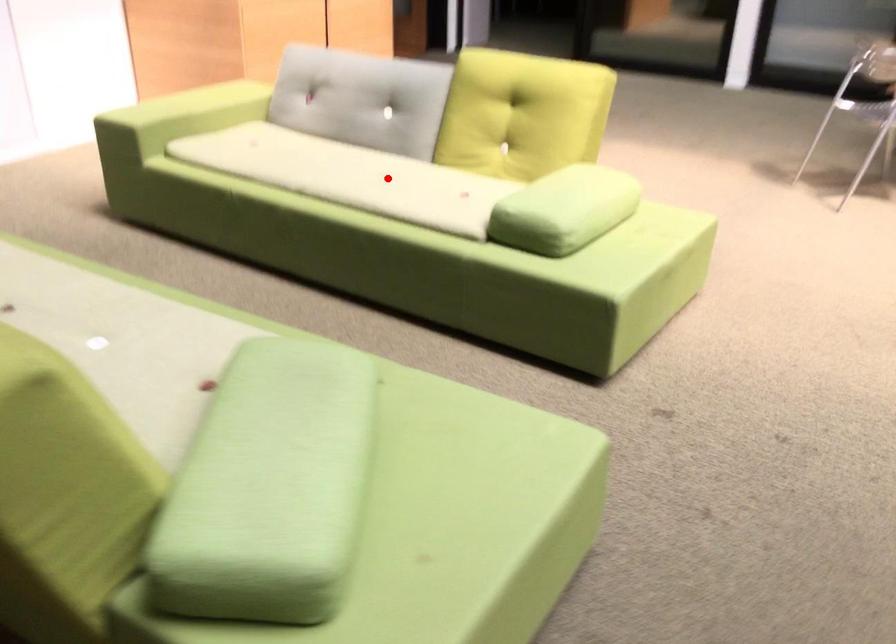
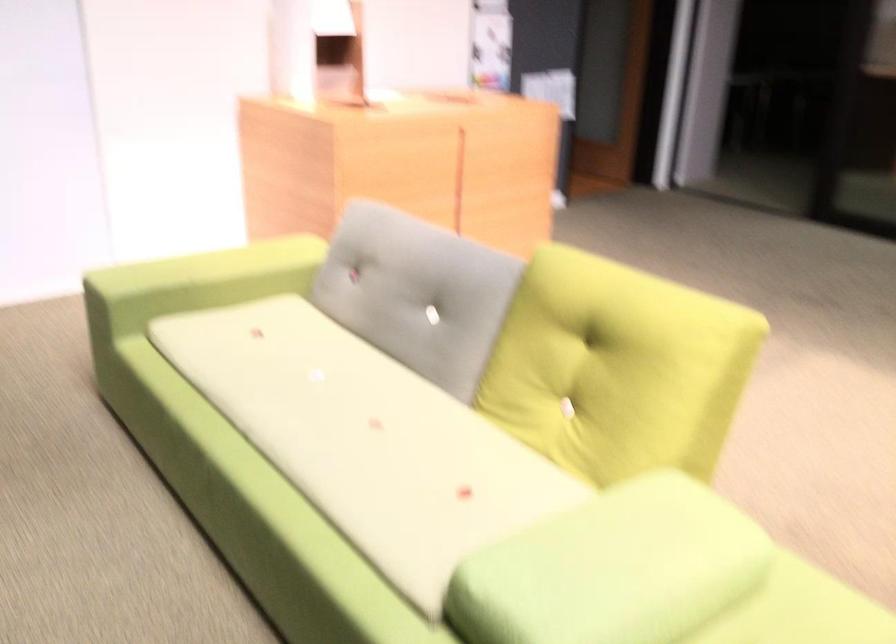
Question: I am providing you with two images of the same scene from different viewpoints. Image1 has a red point marked. In image2, the corresponding 3D location appears at what relative position? Reply with the corresponding letter.

Choices:
 (A) Closer
 (B) Farther

Answer: (A)